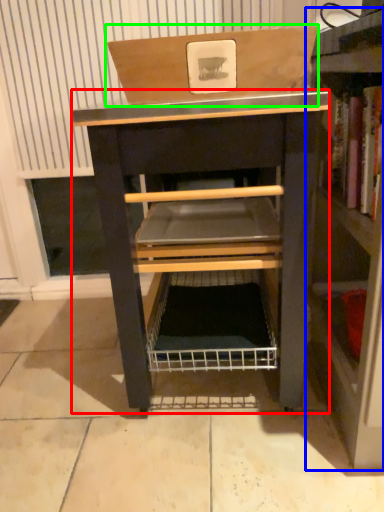
Question: Which object is the closest to the vanity (highlighted by a red box)? Choose among these: shelf (highlighted by a blue box) or cardboard box (highlighted by a green box).

Choices:
 (A) shelf
 (B) cardboard box

Answer: (B)